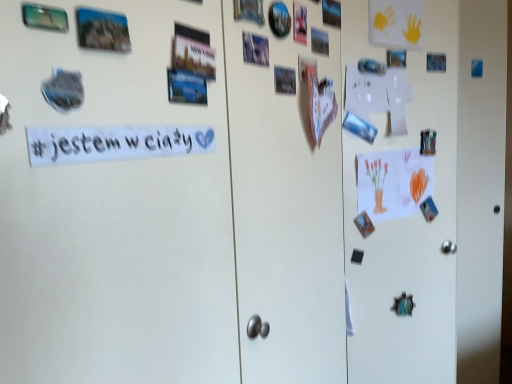
Find the location of a particular element. The image size is (512, 384). white paper at center is located at coordinates (114, 143).

What do you see at coordinates (114, 143) in the screenshot?
I see `white paper at center` at bounding box center [114, 143].

What is the approximate width of white paper at center?

It is 1.40 centimeters.

The image size is (512, 384). Identify the location of white paper at center. (114, 143).